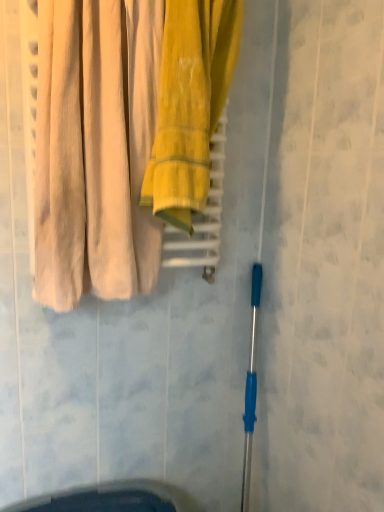
This screenshot has height=512, width=384. What are the coordinates of `beige cotton curtains at left` in the screenshot? It's located at (95, 149).

The image size is (384, 512). Describe the element at coordinates (95, 149) in the screenshot. I see `beige cotton curtains at left` at that location.

This screenshot has height=512, width=384. Describe the element at coordinates (190, 104) in the screenshot. I see `yellow cotton towel at center` at that location.

Locate an element on the screen. yellow cotton towel at center is located at coordinates (190, 104).

You are a GUI agent. You are given a task and a screenshot of the screen. Output one action in this format:
    pyautogui.click(x=<x>, y=<y>)
    Task: Click on the beige cotton curtains at left
    
    Given the screenshot: What is the action you would take?
    pyautogui.click(x=95, y=149)

Which object is positioned more to the left, yellow cotton towel at center or beige cotton curtains at left?

beige cotton curtains at left is more to the left.

Which is in front, yellow cotton towel at center or beige cotton curtains at left?

beige cotton curtains at left is in front.

Which is closer to the camera, [213,33] or [144,261]?

Point [213,33].

In the scene shown: From the image's perspective, does yellow cotton towel at center appear higher than beige cotton curtains at left?

Yes, from the image's perspective, yellow cotton towel at center is on top of beige cotton curtains at left.

From a real-world perspective, which object stands above the other?

yellow cotton towel at center.

Considering the sizes of yellow cotton towel at center and beige cotton curtains at left in the image, is yellow cotton towel at center wider or thinner than beige cotton curtains at left?

yellow cotton towel at center is thinner than beige cotton curtains at left.

Does yellow cotton towel at center have a lesser height compared to beige cotton curtains at left?

No.

From the picture: Can you confirm if yellow cotton towel at center is smaller than beige cotton curtains at left?

Indeed, yellow cotton towel at center has a smaller size compared to beige cotton curtains at left.

Would you say yellow cotton towel at center is outside beige cotton curtains at left?

Yes, yellow cotton towel at center is not within beige cotton curtains at left.

In the scene shown: Is yellow cotton towel at center not close to beige cotton curtains at left?

No, yellow cotton towel at center is in close proximity to beige cotton curtains at left.

Could you tell me if yellow cotton towel at center is turned towards beige cotton curtains at left?

No, yellow cotton towel at center does not turn towards beige cotton curtains at left.

What's the angular difference between yellow cotton towel at center and beige cotton curtains at left's facing directions?

There is a 0.000646-degree angle between the facing directions of yellow cotton towel at center and beige cotton curtains at left.

Measure the distance between yellow cotton towel at center and beige cotton curtains at left.

yellow cotton towel at center is 4.77 inches away from beige cotton curtains at left.

At what (x,y) coordinates should I click in order to perform the action: click on towel behind the beige cotton curtains at left. Please return your answer as a coordinate pair (x, y). This screenshot has height=512, width=384. Looking at the image, I should click on 190,104.

In the scene shown: Considering the relative positions of beige cotton curtains at left and yellow cotton towel at center in the image provided, is beige cotton curtains at left to the left of yellow cotton towel at center from the viewer's perspective?

Yes, beige cotton curtains at left is to the left of yellow cotton towel at center.

Does beige cotton curtains at left lie in front of yellow cotton towel at center?

Yes, beige cotton curtains at left is closer to the camera.

Is point (70, 182) in front of point (189, 198)?

Yes, it is.

From the image's perspective, would you say beige cotton curtains at left is positioned over yellow cotton towel at center?

No, from the image's perspective, beige cotton curtains at left is not over yellow cotton towel at center.

From a real-world perspective, between beige cotton curtains at left and yellow cotton towel at center, who is vertically higher?

yellow cotton towel at center.

Considering the relative sizes of beige cotton curtains at left and yellow cotton towel at center in the image provided, is beige cotton curtains at left wider than yellow cotton towel at center?

Correct, the width of beige cotton curtains at left exceeds that of yellow cotton towel at center.

Is beige cotton curtains at left taller or shorter than yellow cotton towel at center?

beige cotton curtains at left is shorter than yellow cotton towel at center.

Does beige cotton curtains at left have a smaller size compared to yellow cotton towel at center?

No, beige cotton curtains at left is not smaller than yellow cotton towel at center.

Can we say beige cotton curtains at left lies outside yellow cotton towel at center?

beige cotton curtains at left is positioned outside yellow cotton towel at center.

Based on the photo, are beige cotton curtains at left and yellow cotton towel at center located far from each other?

No, beige cotton curtains at left is not far from yellow cotton towel at center.

Is beige cotton curtains at left positioned with its back to yellow cotton towel at center?

beige cotton curtains at left does not have its back to yellow cotton towel at center.

You are a GUI agent. You are given a task and a screenshot of the screen. Output one action in this format:
    pyautogui.click(x=<x>, y=<y>)
    Task: Click on the towel above the beige cotton curtains at left (from a real-world perspective)
    The width and height of the screenshot is (384, 512).
    Given the screenshot: What is the action you would take?
    pyautogui.click(x=190, y=104)

Find the location of a particular element. curtain that is on the left side of yellow cotton towel at center is located at coordinates (95, 149).

I want to click on towel on the right of beige cotton curtains at left, so click(x=190, y=104).